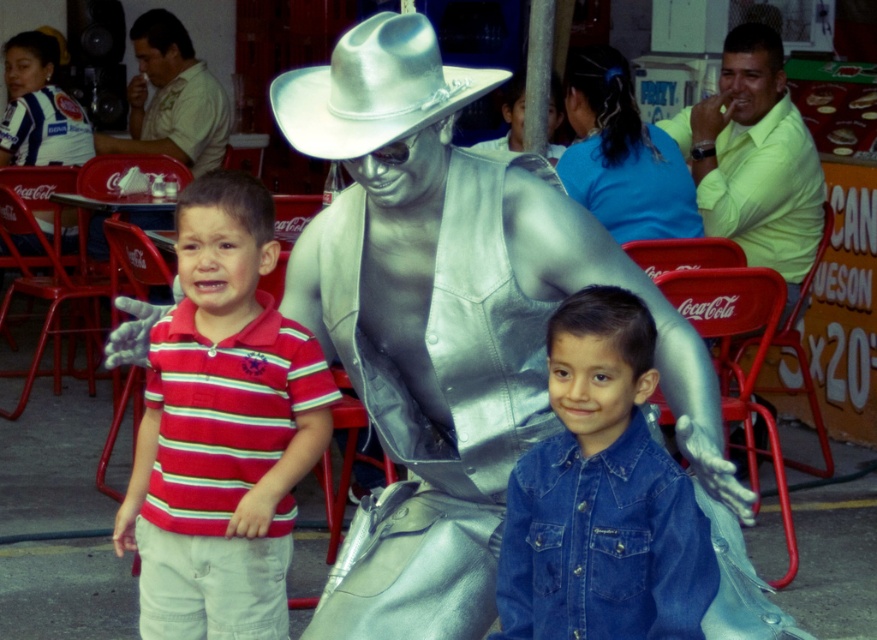
Does light green shirt at right appear over silver metallic cowboy hat at center?

Indeed, light green shirt at right is positioned over silver metallic cowboy hat at center.

Who is more distant from viewer, (781, 172) or (362, 20)?

Point (781, 172)

Identify the location of light green shirt at right. (754, 160).

Looking at this image, which is below, striped cotton shirt at left or light green shirt at right?

striped cotton shirt at left is lower down.

Describe the element at coordinates (222, 428) in the screenshot. I see `striped cotton shirt at left` at that location.

Identify the location of striped cotton shirt at left. (222, 428).

Is point (576, 588) closer to camera compared to point (407, 65)?

Yes, point (576, 588) is closer to viewer.

Who is higher up, denim shirt at center or silver metallic cowboy hat at center?

silver metallic cowboy hat at center is above.

Find the location of `denim shirt at center`. denim shirt at center is located at coordinates (602, 496).